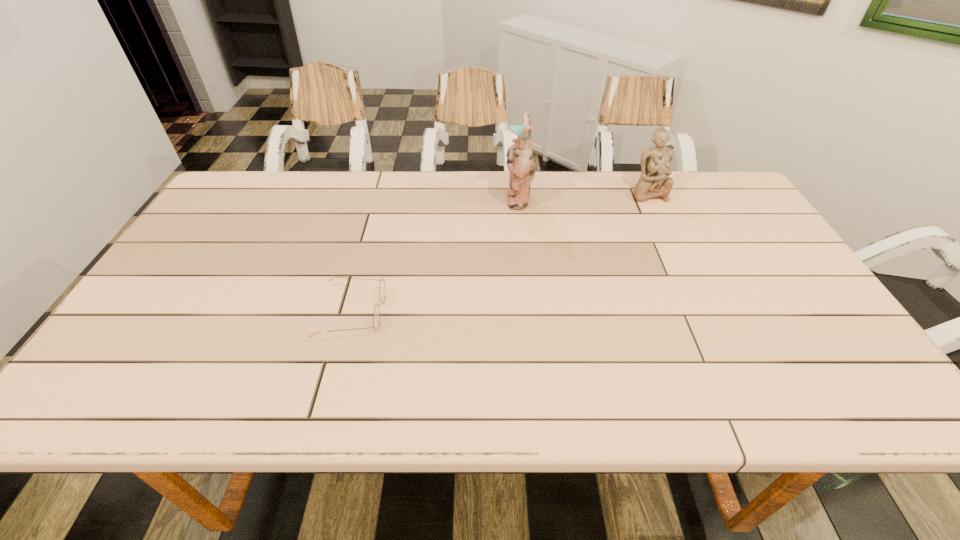
Locate an element on the screen. This screenshot has height=540, width=960. free space between the right figurine and the shortest object is located at coordinates (500, 253).

The width and height of the screenshot is (960, 540). In order to click on blank region between the tallest object and the nearest object in this screenshot , I will do `click(436, 256)`.

In order to click on free spot between the second shortest object and the nearest object in this screenshot , I will do `click(500, 253)`.

The image size is (960, 540). I want to click on free space between the shorter figurine and the nearest object, so click(500, 253).

At what (x,y) coordinates should I click in order to perform the action: click on empty space that is in between the left figurine and the right figurine. Please return your answer as a coordinate pair (x, y). The height and width of the screenshot is (540, 960). Looking at the image, I should click on (583, 196).

Where is `empty location between the leftmost object and the taller figurine`? The width and height of the screenshot is (960, 540). empty location between the leftmost object and the taller figurine is located at coordinates (436, 256).

At what (x,y) coordinates should I click in order to perform the action: click on empty location between the spectacles and the left figurine. Please return your answer as a coordinate pair (x, y). Looking at the image, I should click on (436, 256).

Select which object is the second closest to the second tallest object. Please provide its 2D coordinates. Your answer should be formatted as a tuple, i.e. [(x, y)], where the tuple contains the x and y coordinates of a point satisfying the conditions above.

[(376, 315)]

Identify which object is the closest to the taller figurine. Please provide its 2D coordinates. Your answer should be formatted as a tuple, i.e. [(x, y)], where the tuple contains the x and y coordinates of a point satisfying the conditions above.

[(656, 162)]

Locate an element on the screen. Image resolution: width=960 pixels, height=540 pixels. vacant space that satisfies the following two spatial constraints: 1. on the front-facing side of the second tallest object; 2. on the temples of the shortest object is located at coordinates (705, 313).